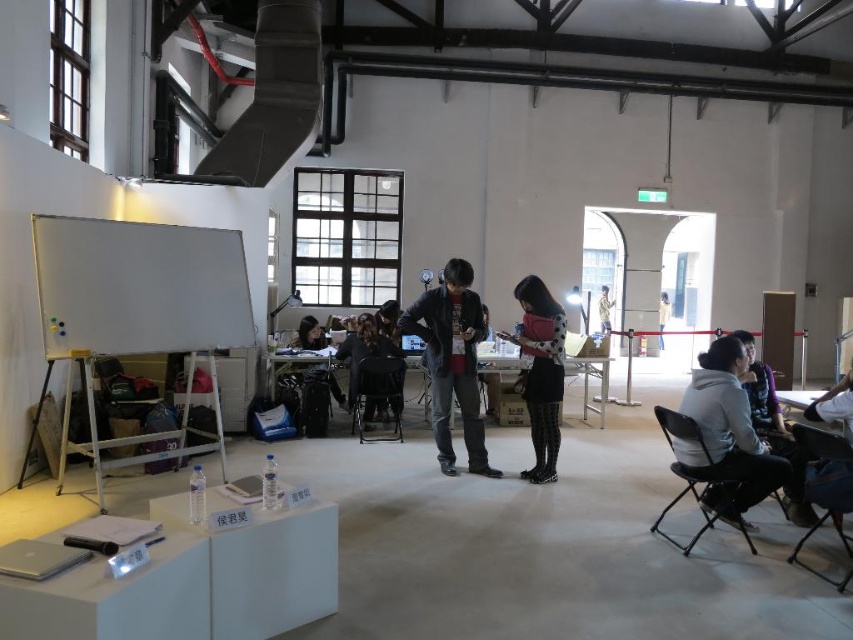
Question: Does gray fabric jacket at lower right appear on the right side of dark gray fabric chair at center?

Choices:
 (A) no
 (B) yes

Answer: (B)

Question: Is black plastic chair at center thinner than khaki cotton shirt at center?

Choices:
 (A) yes
 (B) no

Answer: (B)

Question: Which point is closer to the camera taking this photo?

Choices:
 (A) (601, 323)
 (B) (90, 250)
 (C) (848, 410)
 (D) (831, 502)

Answer: (D)

Question: Which of these objects is positioned closest to the polka dot scarf at center?

Choices:
 (A) matte black jacket at center
 (B) black plastic chair at lower right

Answer: (B)

Question: Which of the following is the farthest from the observer?

Choices:
 (A) (665, 307)
 (B) (386, 372)

Answer: (A)

Question: In this image, where is black plastic chair at lower right located relative to black plastic chair at center?

Choices:
 (A) left
 (B) right

Answer: (B)